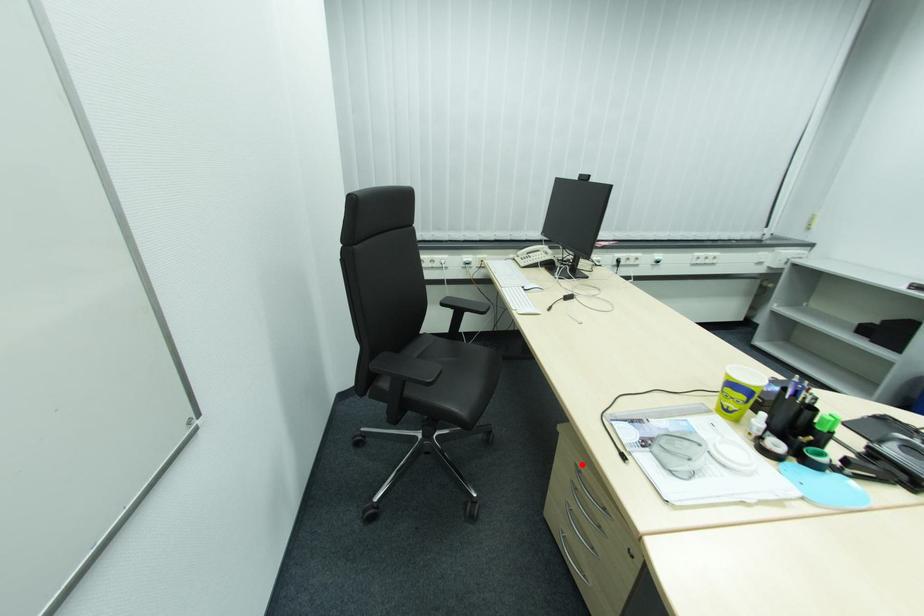
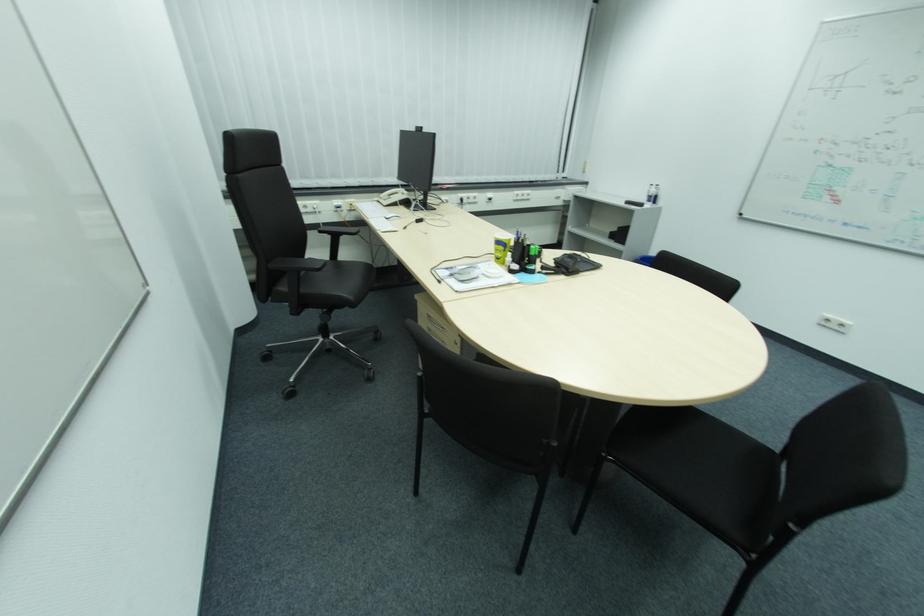
Question: I am providing you with two images of the same scene from different viewpoints. A red point is marked on the first image. Can you still see the location of the red point in image 2?

Choices:
 (A) Yes
 (B) No

Answer: (A)